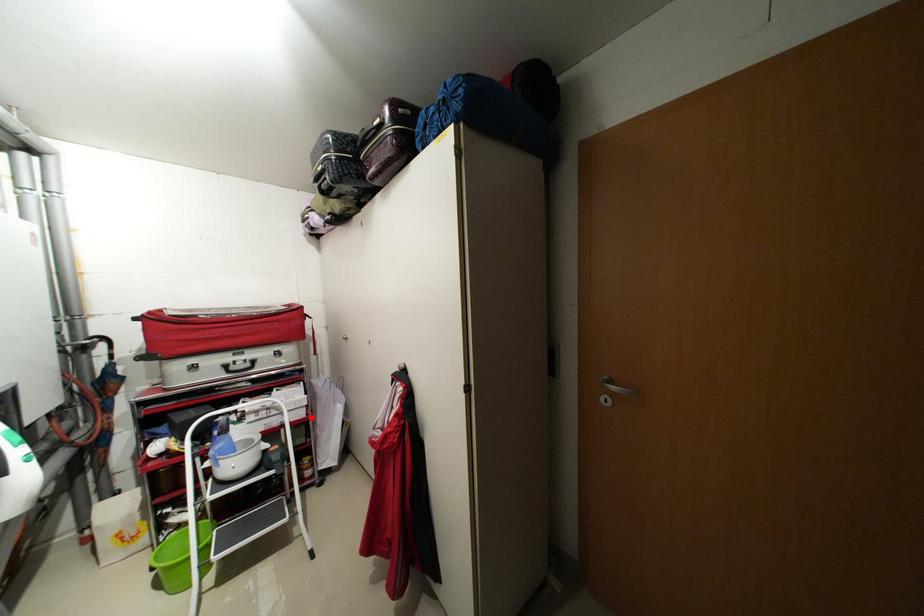
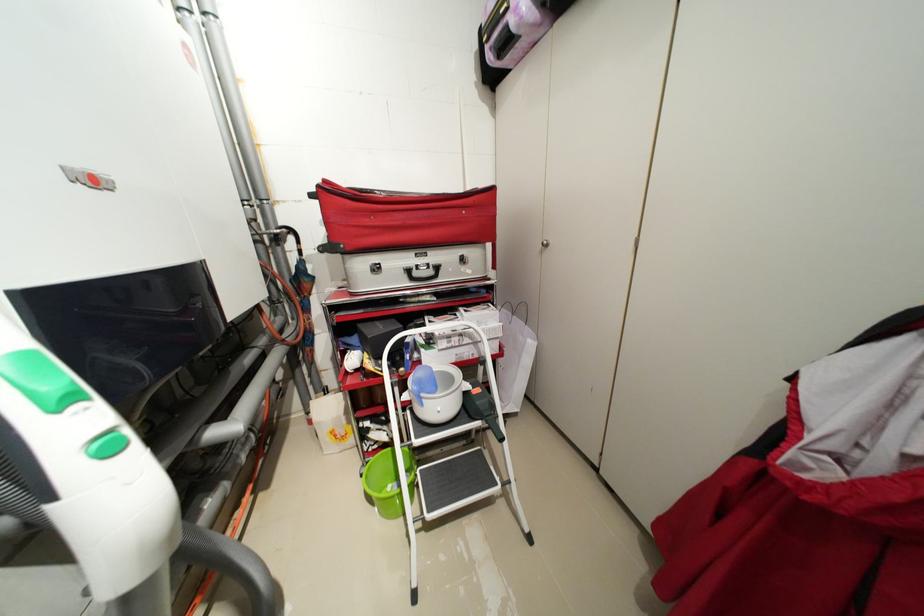
The point at the highlighted location is marked in the first image. Where is the corresponding point in the second image?

(505, 352)